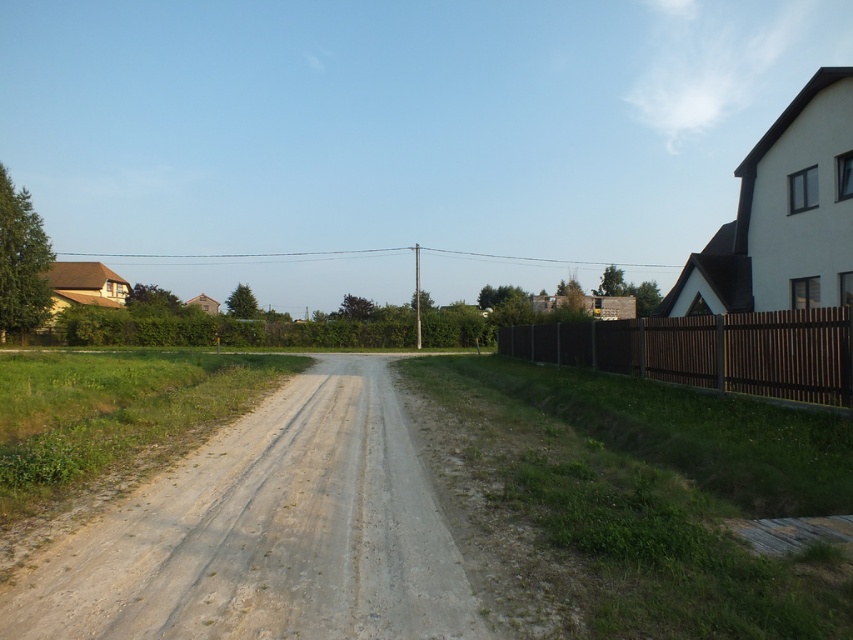
Question: Can you confirm if gray gravel road at center is wider than brown wooden fence at right?

Choices:
 (A) no
 (B) yes

Answer: (A)

Question: Which object is closer to the camera taking this photo?

Choices:
 (A) brown wooden fence at right
 (B) gray gravel road at center

Answer: (B)

Question: Can you confirm if gray gravel road at center is bigger than brown wooden fence at right?

Choices:
 (A) yes
 (B) no

Answer: (B)

Question: Which point appears farthest from the camera in this image?

Choices:
 (A) (642, 342)
 (B) (281, 529)

Answer: (A)

Question: Which of the following is the closest to the observer?

Choices:
 (A) gray gravel road at center
 (B) brown wooden fence at right

Answer: (A)

Question: Is gray gravel road at center thinner than brown wooden fence at right?

Choices:
 (A) no
 (B) yes

Answer: (B)